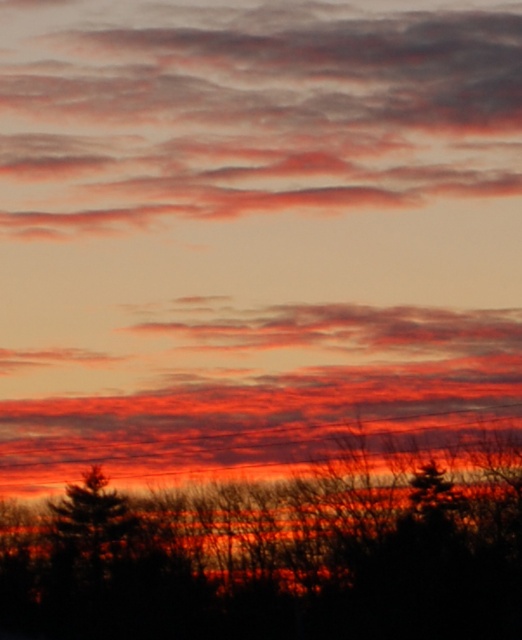
Question: Can you confirm if silhouette bare tree at bottom is positioned to the left of green matte tree at lower left?

Choices:
 (A) yes
 (B) no

Answer: (B)

Question: Which point appears farthest from the camera in this image?

Choices:
 (A) (82, 563)
 (B) (48, 120)
 (C) (454, 474)

Answer: (B)

Question: Which point appears closest to the camera in this image?

Choices:
 (A) (487, 83)
 (B) (92, 566)

Answer: (B)

Question: Which object appears farthest from the camera in this image?

Choices:
 (A) matte orange cloud at upper center
 (B) silhouette bare tree at bottom
 (C) green matte tree at lower left

Answer: (A)

Question: Does matte orange cloud at upper center have a lesser width compared to silhouette bare tree at bottom?

Choices:
 (A) no
 (B) yes

Answer: (A)

Question: Is matte orange cloud at upper center wider than silhouette bare tree at bottom?

Choices:
 (A) no
 (B) yes

Answer: (B)